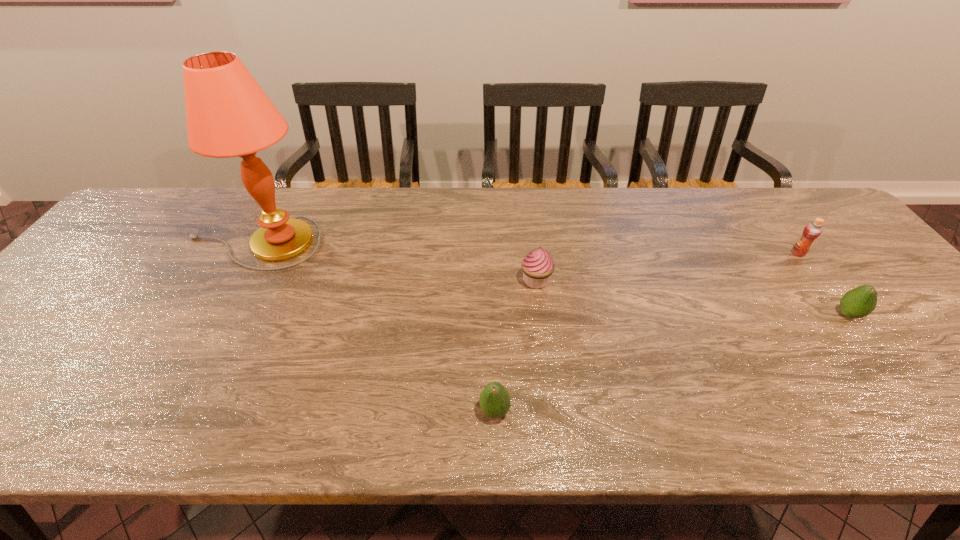
You are a GUI agent. You are given a task and a screenshot of the screen. Output one action in this format:
    pyautogui.click(x=<x>, y=<y>)
    Task: Click on the vacant space positioned on the left of the cupcake
    This screenshot has height=540, width=960.
    Given the screenshot: What is the action you would take?
    pyautogui.click(x=367, y=281)

Find the location of `vacant area situated on the left of the farther avocado`. vacant area situated on the left of the farther avocado is located at coordinates (753, 314).

Identify the location of free location located 0.280m on the right of the second object from left to right. The height and width of the screenshot is (540, 960). (648, 411).

This screenshot has width=960, height=540. In order to click on object that is at the far edge in this screenshot , I will do `click(228, 114)`.

Find the location of `object located at the near edge`. object located at the near edge is located at coordinates (494, 400).

At what (x,y) coordinates should I click in order to perform the action: click on object situated at the right edge. Please return your answer as a coordinate pair (x, y). Looking at the image, I should click on (859, 302).

The height and width of the screenshot is (540, 960). Identify the location of vacant space at the far edge. (306, 198).

In the image, there is a desktop. Identify the location of vacant space at the near edge. (689, 436).

The height and width of the screenshot is (540, 960). What are the coordinates of `vacant space at the left edge of the desktop` in the screenshot? It's located at (120, 293).

You are a GUI agent. You are given a task and a screenshot of the screen. Output one action in this format:
    pyautogui.click(x=<x>, y=<y>)
    Task: Click on the vacant position at the right edge of the desktop
    The height and width of the screenshot is (540, 960).
    Given the screenshot: What is the action you would take?
    pyautogui.click(x=959, y=354)